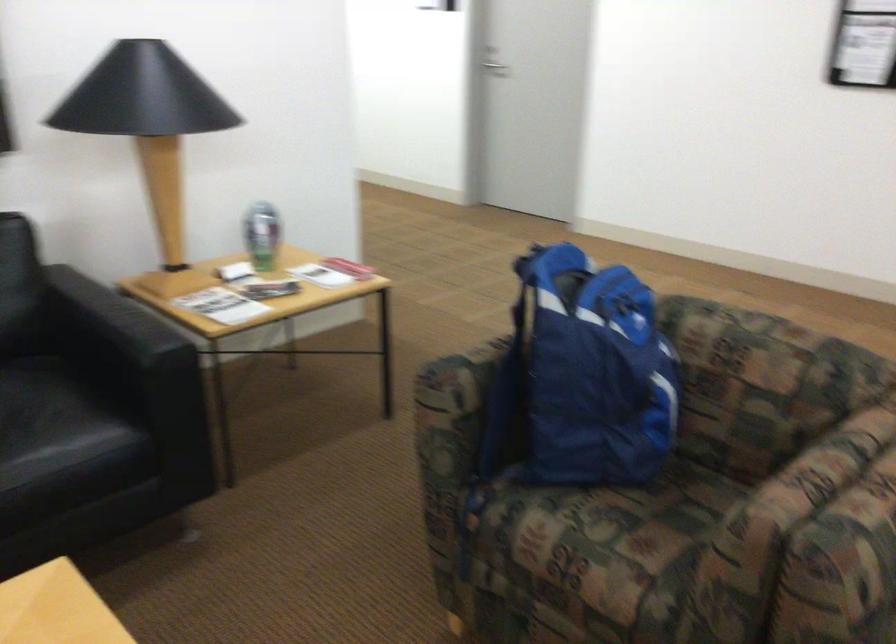
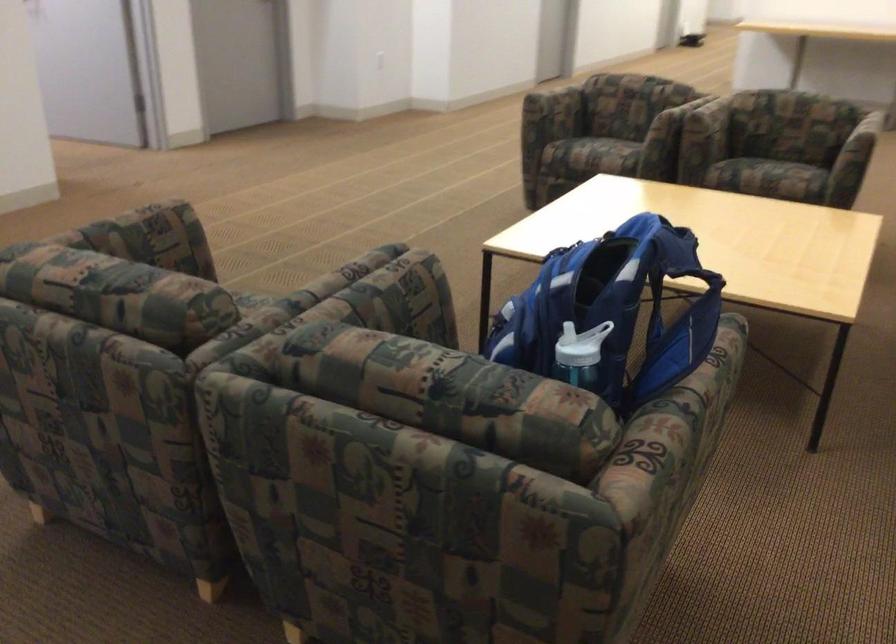
Where in the second image is the point corresponding to point (584, 289) from the first image?

(613, 310)